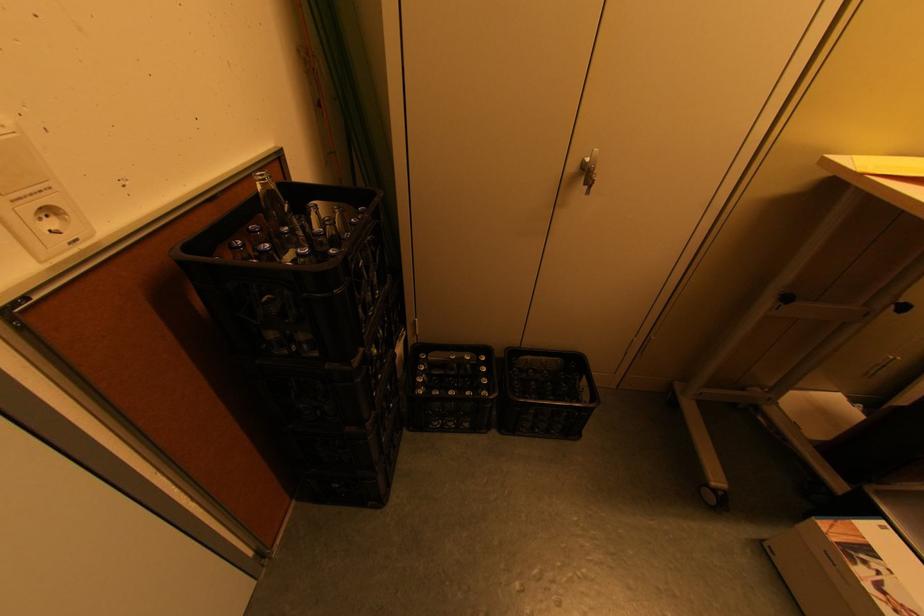
You are a GUI agent. You are given a task and a screenshot of the screen. Output one action in this format:
    pyautogui.click(x=<x>, y=<y>)
    Task: Click on the black crate handle
    
    Given the screenshot: What is the action you would take?
    pyautogui.click(x=578, y=367)